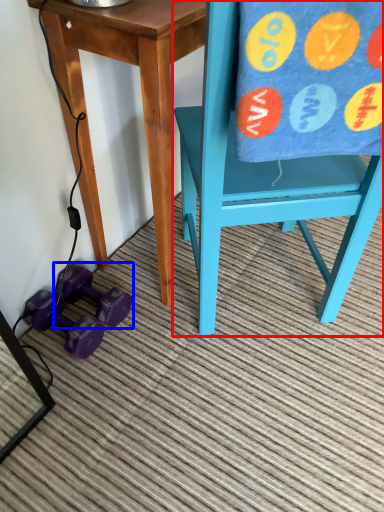
Question: Which object appears farthest to the camera in this image, chair (highlighted by a red box) or dumbbell (highlighted by a blue box)?

Choices:
 (A) chair
 (B) dumbbell

Answer: (B)